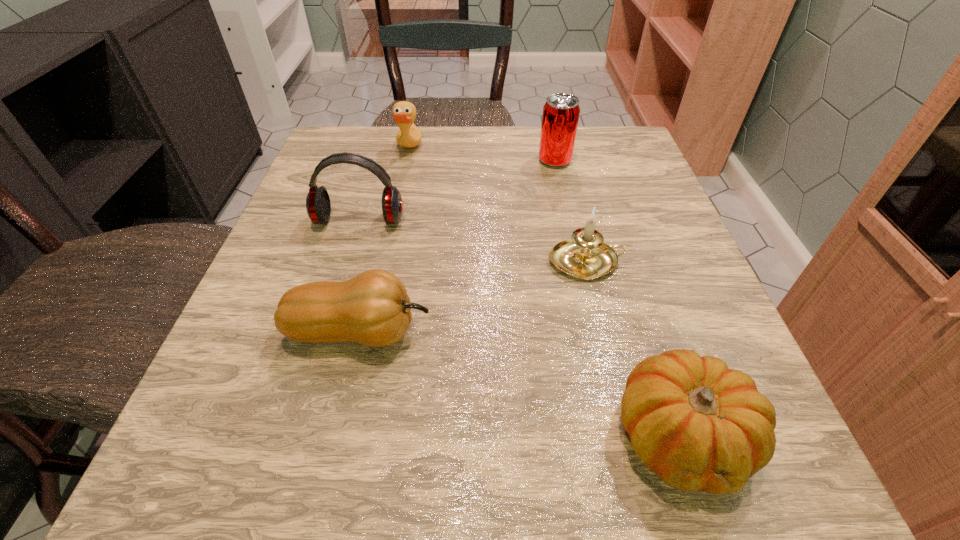
You are a GUI agent. You are given a task and a screenshot of the screen. Output one action in this format:
    pyautogui.click(x=<x>, y=<y>)
    Task: Click on the soda can
    The image size is (960, 540).
    Given the screenshot: What is the action you would take?
    pyautogui.click(x=561, y=112)

Where is `the fourth nearest object`? This screenshot has height=540, width=960. the fourth nearest object is located at coordinates (318, 206).

Where is `duck`? duck is located at coordinates (404, 113).

Locate an element on the screen. The image size is (960, 540). the third nearest object is located at coordinates (582, 257).

You are a GUI agent. You are given a task and a screenshot of the screen. Output one action in this format:
    pyautogui.click(x=<x>, y=<y>)
    Task: Click on the farther gourd
    Image resolution: width=960 pixels, height=540 pixels.
    Given the screenshot: What is the action you would take?
    pyautogui.click(x=373, y=309)

Locate an element on the screen. This screenshot has height=540, width=960. the left gourd is located at coordinates (373, 309).

Where is `the right gourd`? The image size is (960, 540). the right gourd is located at coordinates [x=700, y=426].

At what (x,y) coordinates should I click in order to perform the action: click on the nearest object. Please return your answer as a coordinate pair (x, y). Looking at the image, I should click on coord(700,426).

Locate an element on the screen. free region located on the right of the soda can is located at coordinates (640, 161).

I want to click on free space located on the ear cups of the earphone, so click(x=331, y=315).